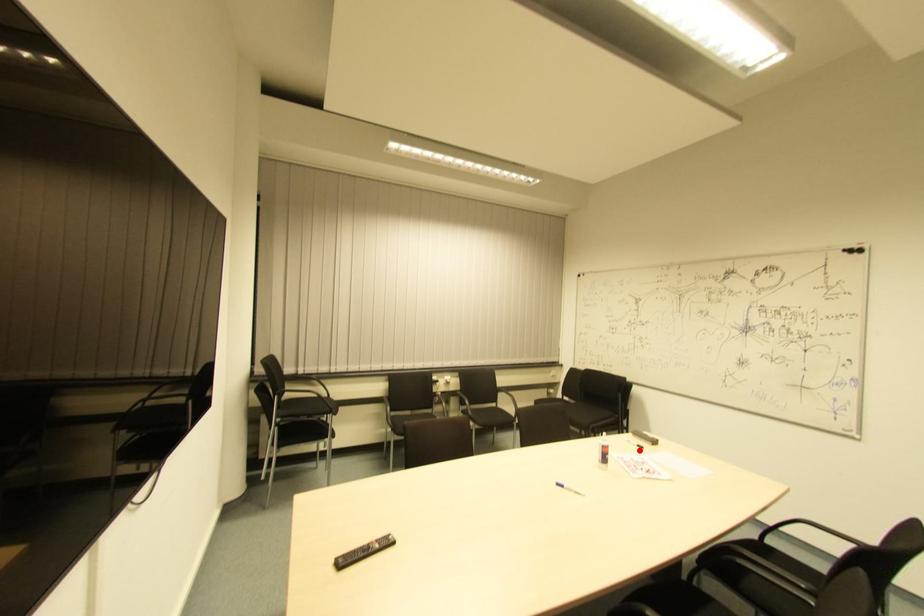
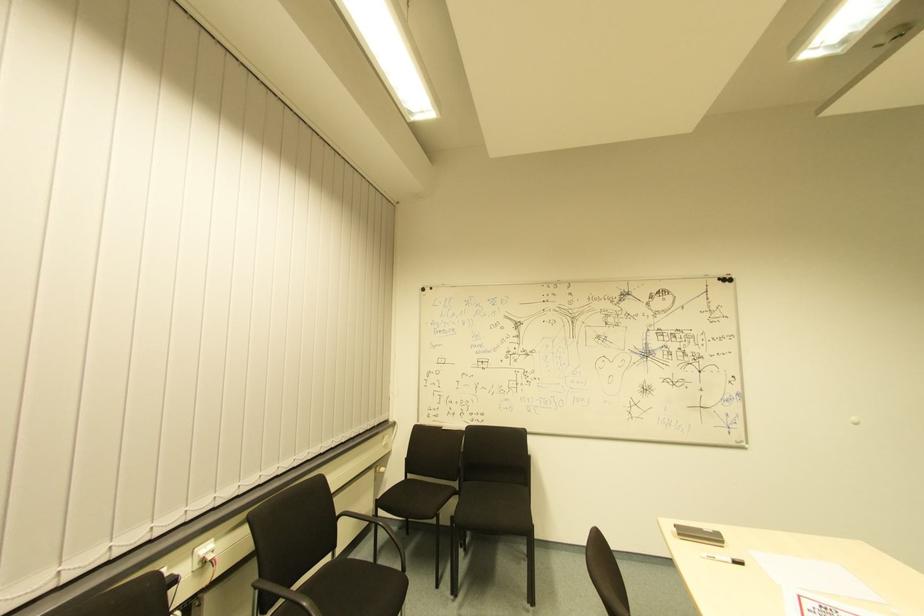
Question: A red point is marked in image1. In image2, is the corresponding 3D point closer to the camera or farther? Reply with the corresponding letter.

Choices:
 (A) The corresponding 3D point is closer.
 (B) The corresponding 3D point is farther.

Answer: (B)